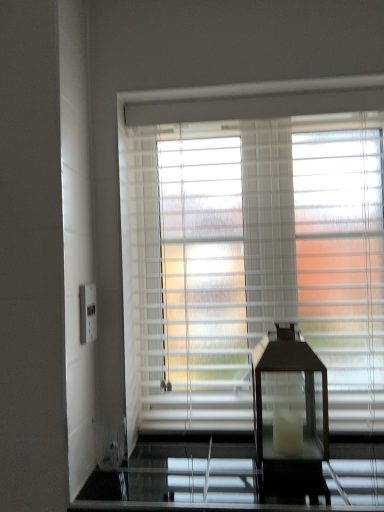
Question: In terms of width, does white plastic electric outlet at left look wider or thinner when compared to white textured blinds at center?

Choices:
 (A) wide
 (B) thin

Answer: (B)

Question: Considering the relative positions of white plastic electric outlet at left and white textured blinds at center in the image provided, is white plastic electric outlet at left to the left or to the right of white textured blinds at center?

Choices:
 (A) left
 (B) right

Answer: (A)

Question: Considering the real-world distances, which object is farthest from the white plastic electric outlet at left?

Choices:
 (A) black glass table lamp at center
 (B) white textured blinds at center

Answer: (A)

Question: Estimate the real-world distances between objects in this image. Which object is closer to the white plastic electric outlet at left?

Choices:
 (A) black glass table lamp at center
 (B) white textured blinds at center

Answer: (B)